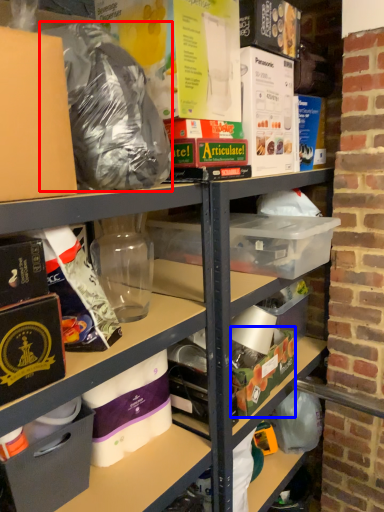
Question: Which point is further to the camera, waste (highlighted by a red box) or box (highlighted by a blue box)?

Choices:
 (A) waste
 (B) box

Answer: (B)